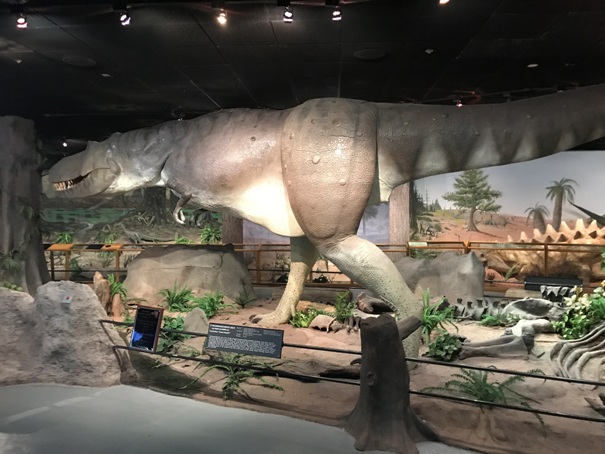
Identify the location of lights. (17, 22), (123, 23), (218, 20), (287, 15), (336, 19), (440, 6).